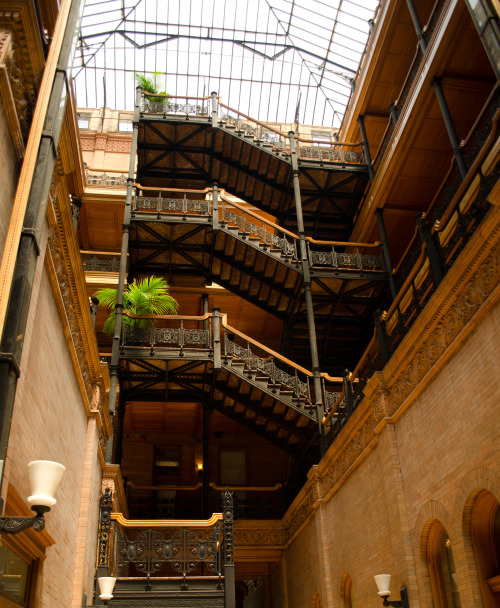
Find the location of a particular element. The width and height of the screenshot is (500, 608). skylight is located at coordinates (279, 60).